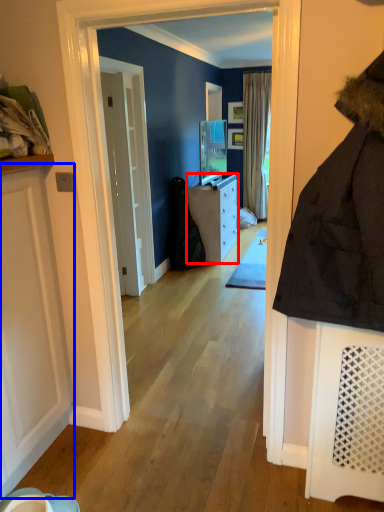
Question: Which of the following is the closest to the observer, cabinetry (highlighted by a red box) or door (highlighted by a blue box)?

Choices:
 (A) cabinetry
 (B) door

Answer: (B)